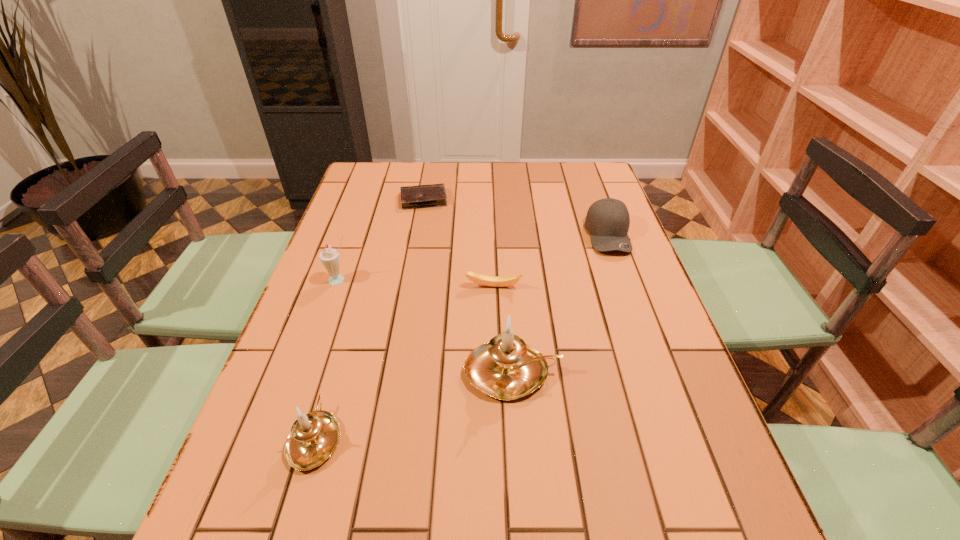
Find the location of a particular element. The width and height of the screenshot is (960, 540). free space between the second farthest object and the milkshake is located at coordinates (474, 258).

Identify the location of vacant space that is in between the milkshake and the second shortest object. This screenshot has height=540, width=960. (417, 284).

Where is `free point between the shortest object and the rightmost object`? The height and width of the screenshot is (540, 960). free point between the shortest object and the rightmost object is located at coordinates (516, 217).

The height and width of the screenshot is (540, 960). In order to click on empty space between the rightmost object and the banana in this screenshot , I will do (551, 261).

Locate an element on the screen. This screenshot has width=960, height=540. vacant area between the second shortest object and the tallest object is located at coordinates (503, 330).

This screenshot has width=960, height=540. Identify the location of unoccupied area between the milkshake and the rightmost object. (474, 258).

The image size is (960, 540). I want to click on vacant space that is in between the third shortest object and the taller candle holder, so click(561, 303).

Locate an element on the screen. free space between the nearest object and the milkshake is located at coordinates (327, 359).

Where is `the closest object relative to the milkshake`? the closest object relative to the milkshake is located at coordinates click(x=493, y=281).

Find the location of `the fourth closest object to the tallest object`. the fourth closest object to the tallest object is located at coordinates (330, 258).